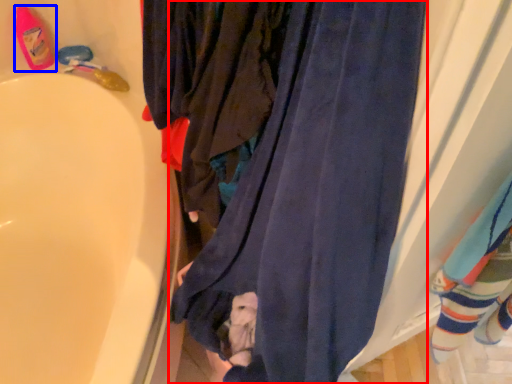
Question: Which object appears closest to the camera in this image, curtain (highlighted by a red box) or footwear (highlighted by a blue box)?

Choices:
 (A) curtain
 (B) footwear

Answer: (A)